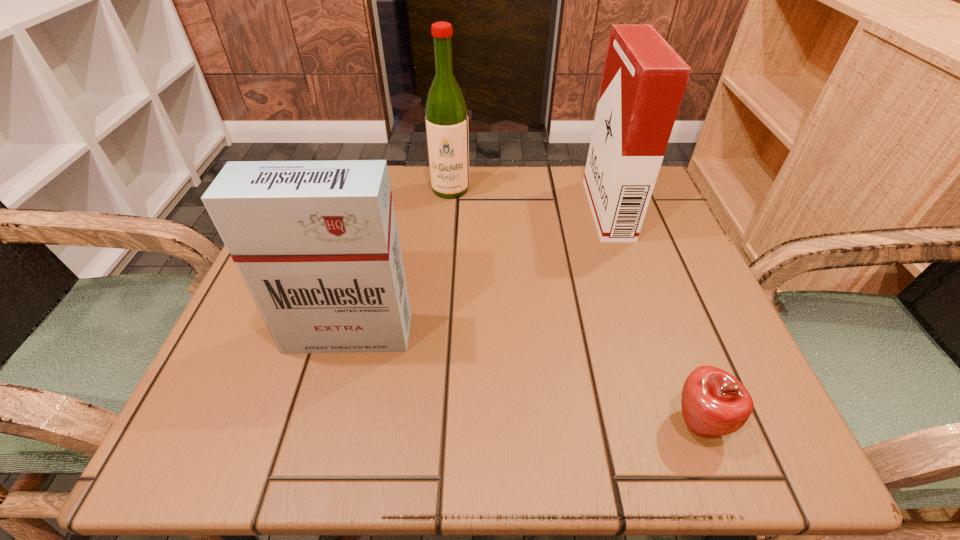
I want to click on liquor, so pyautogui.click(x=446, y=118).

Locate an element on the screen. This screenshot has height=540, width=960. the farther cigarette case is located at coordinates (644, 79).

Where is `the second nearest object`? This screenshot has width=960, height=540. the second nearest object is located at coordinates pyautogui.click(x=316, y=243).

Locate an element on the screen. the leftmost object is located at coordinates (316, 243).

The image size is (960, 540). Identify the location of the nearest object. (714, 403).

Identify the location of the shortest object. The height and width of the screenshot is (540, 960). coord(714,403).

The height and width of the screenshot is (540, 960). In order to click on blank area located 0.220m on the label of the second object from left to right in this screenshot , I will do `click(444, 271)`.

The width and height of the screenshot is (960, 540). In order to click on free space located 0.380m on the front-facing side of the right cigarette case in this screenshot , I will do `click(410, 210)`.

Identify the location of free space located on the front-facing side of the right cigarette case. The width and height of the screenshot is (960, 540). (491, 210).

Find the location of a particular element. Image resolution: width=960 pixels, height=540 pixels. vacant space located 0.280m on the front-facing side of the right cigarette case is located at coordinates (457, 210).